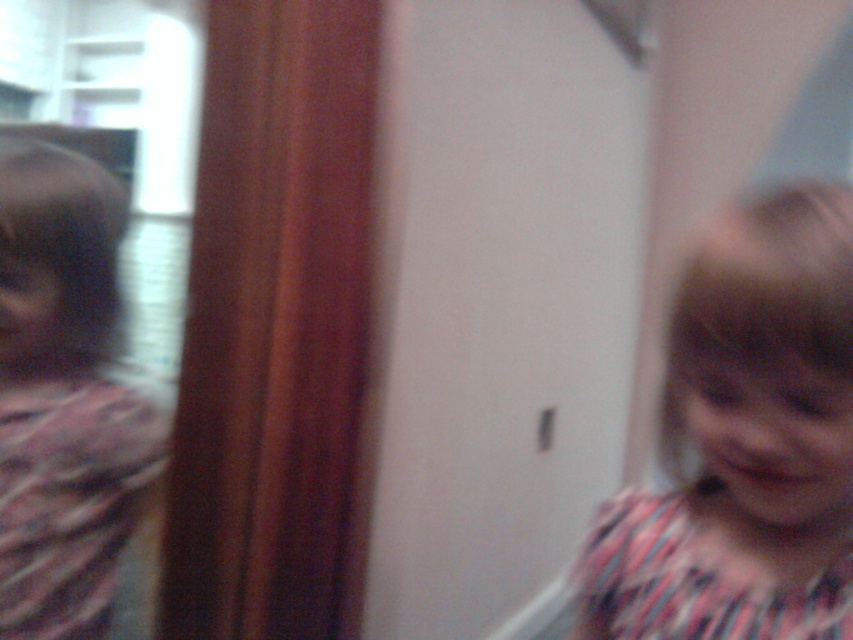
You are a photographer trying to capture both the pink striped shirt at right and the matte pink scarf at left in a clear shot. Since the image is slightly blurred, you decide to adjust your focus. Which object should you focus on first to ensure the smaller one is sharp?

The pink striped shirt at right is smaller in size compared to the matte pink scarf at left. To ensure the smaller object is sharp, focus on the pink striped shirt at right first.

You are a photographer trying to adjust the lighting in the scene to ensure both the pink striped shirt at right and the matte pink scarf at left are clearly visible. Considering their sizes, which object might require more focused lighting adjustments to avoid being overshadowed?

The pink striped shirt at right has a lesser height compared to the matte pink scarf at left, so it might require more focused lighting adjustments to ensure it isn not overshadowed by the taller scarf.

Consider the image. Based on the scene description, can you determine which object is positioned to the right of the other between the pink striped shirt at right and the matte pink scarf at left?

The pink striped shirt at right is positioned to the right of the matte pink scarf at left according to the description.